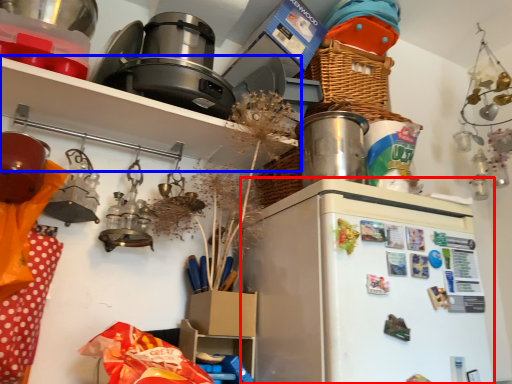
Question: Among these objects, which one is farthest to the camera, fridge (highlighted by a red box) or shelf (highlighted by a blue box)?

Choices:
 (A) fridge
 (B) shelf

Answer: (B)